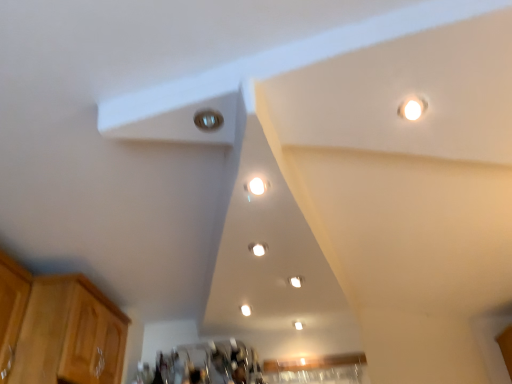
Question: Is metallic silver light at upper center to the left of light brown wood cabinet at lower left from the viewer's perspective?

Choices:
 (A) yes
 (B) no

Answer: (B)

Question: Can you see metallic silver light at upper center touching light brown wood cabinet at lower left?

Choices:
 (A) no
 (B) yes

Answer: (A)

Question: Considering the relative sizes of metallic silver light at upper center and light brown wood cabinet at lower left in the image provided, is metallic silver light at upper center wider than light brown wood cabinet at lower left?

Choices:
 (A) no
 (B) yes

Answer: (A)

Question: Does metallic silver light at upper center turn towards light brown wood cabinet at lower left?

Choices:
 (A) yes
 (B) no

Answer: (B)

Question: Considering the relative positions of metallic silver light at upper center and light brown wood cabinet at lower left in the image provided, is metallic silver light at upper center behind light brown wood cabinet at lower left?

Choices:
 (A) no
 (B) yes

Answer: (A)

Question: Is light brown wood cabinet at lower left at the back of metallic silver light at upper center?

Choices:
 (A) no
 (B) yes

Answer: (A)

Question: Can you confirm if metallic silver light at upper center is wider than white glossy light fixture at center, which ranks as the third dot in bottom-to-top order?

Choices:
 (A) no
 (B) yes

Answer: (B)

Question: Is metallic silver light at upper center turned away from white glossy light fixture at center, which ranks as the third dot in bottom-to-top order?

Choices:
 (A) no
 (B) yes

Answer: (A)

Question: Does metallic silver light at upper center lie behind white glossy light fixture at center, which ranks as the third dot in bottom-to-top order?

Choices:
 (A) no
 (B) yes

Answer: (A)

Question: Is metallic silver light at upper center oriented towards white glossy light fixture at center, the 3th dot when ordered from right to left?

Choices:
 (A) yes
 (B) no

Answer: (B)

Question: From the image's perspective, is metallic silver light at upper center beneath white glossy light fixture at center, the 3th dot when ordered from right to left?

Choices:
 (A) no
 (B) yes

Answer: (A)

Question: From a real-world perspective, is metallic silver light at upper center beneath white glossy light fixture at center, which is the 1th dot from front to back?

Choices:
 (A) yes
 (B) no

Answer: (B)

Question: Can you confirm if matte white light fixture at center, the second dot positioned from the top, is positioned to the left of metallic silver light at upper center?

Choices:
 (A) yes
 (B) no

Answer: (B)